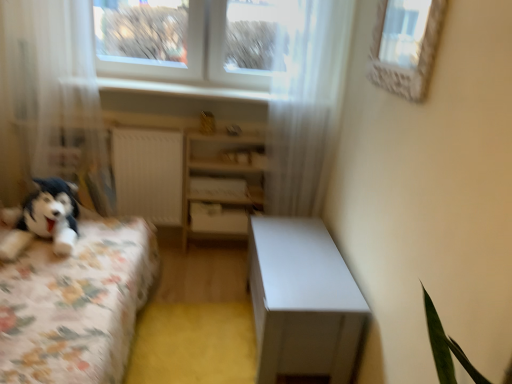
Where is `fluffy fabric bed at left`? This screenshot has width=512, height=384. fluffy fabric bed at left is located at coordinates (71, 293).

Describe the element at coordinates (71, 293) in the screenshot. I see `fluffy fabric bed at left` at that location.

This screenshot has width=512, height=384. What do you see at coordinates (302, 109) in the screenshot?
I see `white sheer curtain at upper center, which ranks as the second curtain in left-to-right order` at bounding box center [302, 109].

Describe the element at coordinates (302, 300) in the screenshot. I see `white glossy table at center` at that location.

Where is `white glossy window sill at upper center`? white glossy window sill at upper center is located at coordinates (181, 89).

Locate an element on the screen. fluffy fabric bed at left is located at coordinates (71, 293).

What's the angular difference between white sheer curtain at left, which is the 1th curtain in left-to-right order, and white glossy window sill at upper center's facing directions?

white sheer curtain at left, which is the 1th curtain in left-to-right order, and white glossy window sill at upper center are facing 0.157 degrees away from each other.

Is white sheer curtain at left, which is the 1th curtain in left-to-right order, in front of white glossy window sill at upper center?

Yes, white sheer curtain at left, which is the 1th curtain in left-to-right order, is in front of white glossy window sill at upper center.

Looking at the image, does white sheer curtain at left, the 2th curtain when ordered from right to left, seem bigger or smaller compared to white glossy window sill at upper center?

In the image, white sheer curtain at left, the 2th curtain when ordered from right to left, appears to be larger than white glossy window sill at upper center.

Can you confirm if white sheer curtain at left, the 2th curtain when ordered from right to left, is positioned to the right of white glossy window sill at upper center?

No, white sheer curtain at left, the 2th curtain when ordered from right to left, is not to the right of white glossy window sill at upper center.

Where is `window sill above the white sheer curtain at left, which is the 1th curtain in left-to-right order (from the image's perspective)`? window sill above the white sheer curtain at left, which is the 1th curtain in left-to-right order (from the image's perspective) is located at coordinates (181, 89).

Are white glossy window sill at upper center and white sheer curtain at left, which is the 1th curtain in left-to-right order, making contact?

white glossy window sill at upper center and white sheer curtain at left, which is the 1th curtain in left-to-right order, are not in contact.

Between white glossy window sill at upper center and white sheer curtain at left, the 2th curtain when ordered from right to left, which one has larger size?

With larger size is white sheer curtain at left, the 2th curtain when ordered from right to left.

Which is more to the left, white glossy window sill at upper center or white sheer curtain at left, the 2th curtain when ordered from right to left?

From the viewer's perspective, white sheer curtain at left, the 2th curtain when ordered from right to left, appears more on the left side.

From a real-world perspective, who is located lower, white sheer curtain at upper center, which ranks as the second curtain in left-to-right order, or white sheer curtain at left, which is the 1th curtain in left-to-right order?

white sheer curtain at left, which is the 1th curtain in left-to-right order.

Which object is further away from the camera, white sheer curtain at upper center, which is counted as the 1th curtain, starting from the right, or white sheer curtain at left, which is the 1th curtain in left-to-right order?

Positioned behind is white sheer curtain at upper center, which is counted as the 1th curtain, starting from the right.

Considering the relative sizes of white sheer curtain at upper center, which is counted as the 1th curtain, starting from the right, and white sheer curtain at left, the 2th curtain when ordered from right to left, in the image provided, is white sheer curtain at upper center, which is counted as the 1th curtain, starting from the right, taller than white sheer curtain at left, the 2th curtain when ordered from right to left,?

Indeed, white sheer curtain at upper center, which is counted as the 1th curtain, starting from the right, has a greater height compared to white sheer curtain at left, the 2th curtain when ordered from right to left.

Considering the points (298, 127) and (90, 103), which point is in front, point (298, 127) or point (90, 103)?

The point (90, 103) is more forward.

From a real-world perspective, is white glossy window sill at upper center positioned under fluffy fabric bed at left based on gravity?

No, from a real-world perspective, white glossy window sill at upper center is not beneath fluffy fabric bed at left.

Considering the points (125, 79) and (125, 279), which point is behind, point (125, 79) or point (125, 279)?

Positioned behind is point (125, 79).

Who is more distant, white glossy window sill at upper center or fluffy fabric bed at left?

white glossy window sill at upper center is further from the camera.

Looking at this image, from the image's perspective, who appears lower, white glossy window sill at upper center or fluffy fabric bed at left?

fluffy fabric bed at left is shown below in the image.

Who is smaller, white matte drawer at center or white textured frame at upper right?

white matte drawer at center.

Visually, is white matte drawer at center positioned to the left or to the right of white textured frame at upper right?

Clearly, white matte drawer at center is on the left of white textured frame at upper right in the image.

Does white matte drawer at center turn towards white textured frame at upper right?

No, white matte drawer at center does not turn towards white textured frame at upper right.

From the image's perspective, which object appears higher, white matte drawer at center or white textured frame at upper right?

white textured frame at upper right, from the image's perspective.

How distant is white glossy table at center from white sheer curtain at upper center, which is counted as the 1th curtain, starting from the right?

A distance of 69.40 centimeters exists between white glossy table at center and white sheer curtain at upper center, which is counted as the 1th curtain, starting from the right.

Between white glossy table at center and white sheer curtain at upper center, which ranks as the second curtain in left-to-right order, which one has smaller width?

white sheer curtain at upper center, which ranks as the second curtain in left-to-right order, is thinner.

Where is `curtain on the right of white glossy table at center`? Image resolution: width=512 pixels, height=384 pixels. curtain on the right of white glossy table at center is located at coordinates (302, 109).

Is white glossy table at center bigger than white sheer curtain at upper center, which is counted as the 1th curtain, starting from the right?

Correct, white glossy table at center is larger in size than white sheer curtain at upper center, which is counted as the 1th curtain, starting from the right.

Does white glossy table at center have a greater width compared to white wood shelf at center?

Correct, the width of white glossy table at center exceeds that of white wood shelf at center.

From a real-world perspective, is white glossy table at center physically above white wood shelf at center?

No, from a real-world perspective, white glossy table at center is not over white wood shelf at center

Would you say white glossy table at center is to the left or to the right of white wood shelf at center in the picture?

Clearly, white glossy table at center is on the right of white wood shelf at center in the image.

Locate an element on the screen. This screenshot has height=384, width=512. curtain that is the 2nd object located in front of the white glossy window sill at upper center is located at coordinates (54, 97).

Identify the location of window sill that appears on the right of white sheer curtain at left, the 2th curtain when ordered from right to left. (181, 89).

Which object lies nearer to the anchor point white wood shelf at center, white sheer curtain at left, the 2th curtain when ordered from right to left, or white sheer curtain at upper center, which is counted as the 1th curtain, starting from the right?

white sheer curtain at upper center, which is counted as the 1th curtain, starting from the right, lies closer to white wood shelf at center than the other object.

Estimate the real-world distances between objects in this image. Which object is further from white matte drawer at center, white glossy table at center or white wood shelf at center?

Among the two, white glossy table at center is located further to white matte drawer at center.

Considering their positions, is white sheer curtain at upper center, which is counted as the 1th curtain, starting from the right, positioned further to white textured frame at upper right than white matte drawer at center?

Among the two, white matte drawer at center is located further to white textured frame at upper right.

When comparing their distances from white sheer curtain at upper center, which is counted as the 1th curtain, starting from the right, does white wood shelf at center or white textured frame at upper right seem further?

white textured frame at upper right lies further to white sheer curtain at upper center, which is counted as the 1th curtain, starting from the right, than the other object.

Estimate the real-world distances between objects in this image. Which object is closer to fluffy fabric bed at left, white textured frame at upper right or white matte drawer at center?

white matte drawer at center.

Looking at the image, which one is located closer to white sheer curtain at upper center, which ranks as the second curtain in left-to-right order, white sheer curtain at left, which is the 1th curtain in left-to-right order, or white matte drawer at center?

white matte drawer at center.

Looking at the image, which one is located further to white sheer curtain at left, the 2th curtain when ordered from right to left, white matte drawer at center or white sheer curtain at upper center, which is counted as the 1th curtain, starting from the right?

white sheer curtain at upper center, which is counted as the 1th curtain, starting from the right.

Considering their positions, is fluffy fabric bed at left positioned further to white textured frame at upper right than white glossy table at center?

fluffy fabric bed at left is positioned further to the anchor white textured frame at upper right.

Identify the location of window sill between white sheer curtain at left, the 2th curtain when ordered from right to left, and white textured frame at upper right, in the horizontal direction. (181, 89).

Where is `table between white textured frame at upper right and white matte drawer at center in the front-back direction`? Image resolution: width=512 pixels, height=384 pixels. table between white textured frame at upper right and white matte drawer at center in the front-back direction is located at coordinates (302, 300).

This screenshot has width=512, height=384. I want to click on curtain between white sheer curtain at left, which is the 1th curtain in left-to-right order, and white textured frame at upper right from left to right, so click(302, 109).

Find the location of a particular element. The height and width of the screenshot is (384, 512). table between fluffy fabric bed at left and white sheer curtain at left, the 2th curtain when ordered from right to left, in the front-back direction is located at coordinates (302, 300).